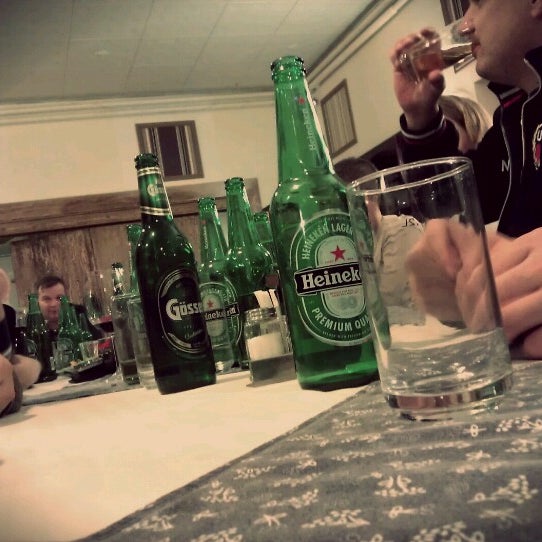
In order to click on table in this screenshot , I will do `click(180, 448)`.